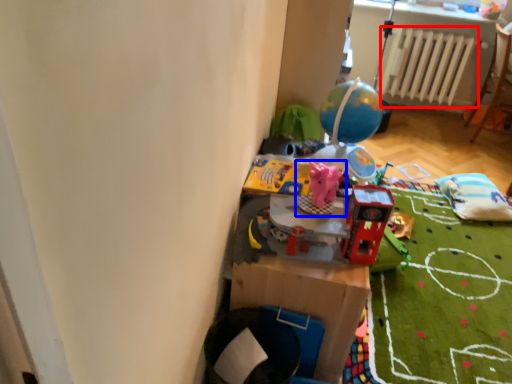
Question: Which point is further to the camera, radiator (highlighted by a red box) or toy (highlighted by a blue box)?

Choices:
 (A) radiator
 (B) toy

Answer: (A)